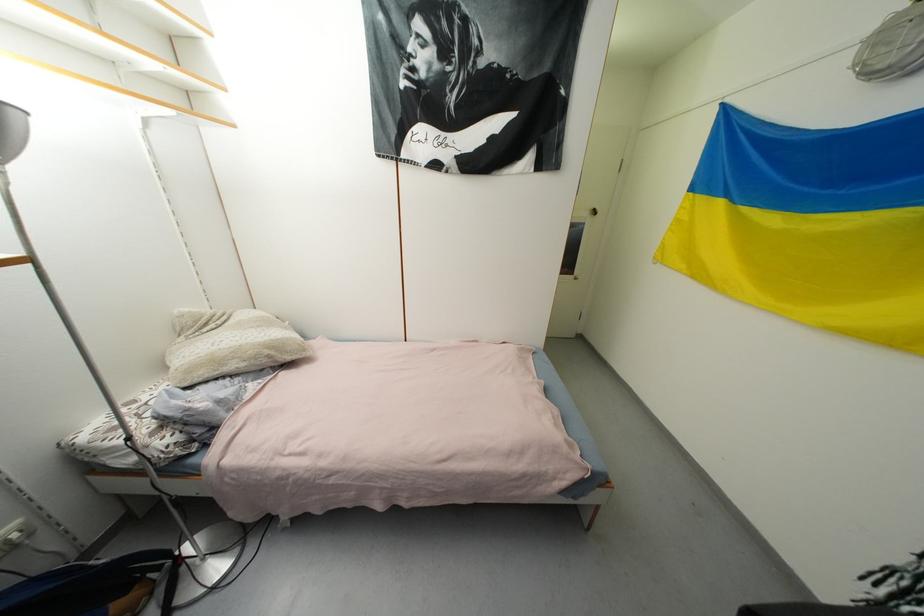
Find the location of a particular element. This screenshot has height=616, width=924. patterned white pillow is located at coordinates (227, 344).